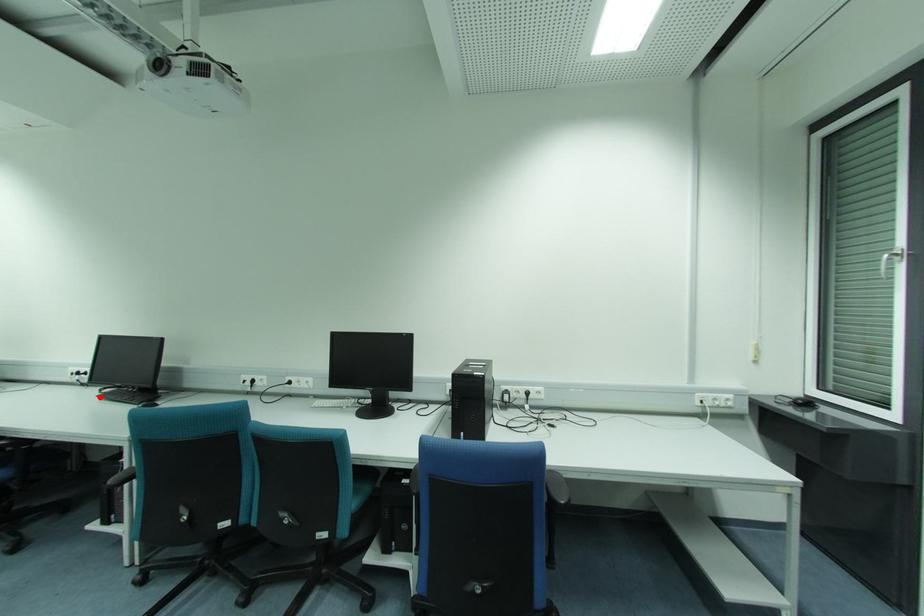
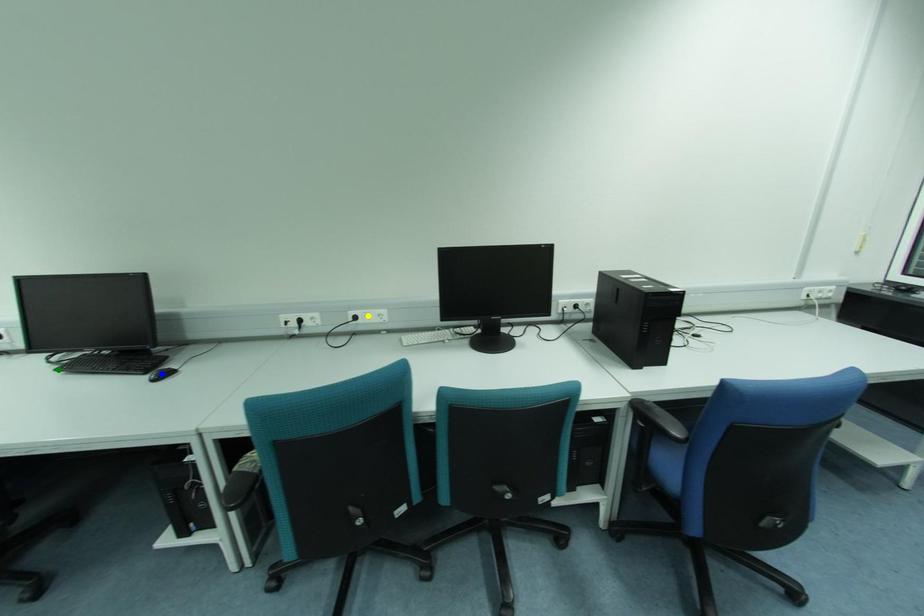
Question: I am providing you with two images of the same scene from different viewpoints. A red point is marked on the first image. You are given multiple points on the second image. Which spot in image 2 lines up with the point in image 1?

Choices:
 (A) yellow point
 (B) blue point
 (C) green point

Answer: (C)